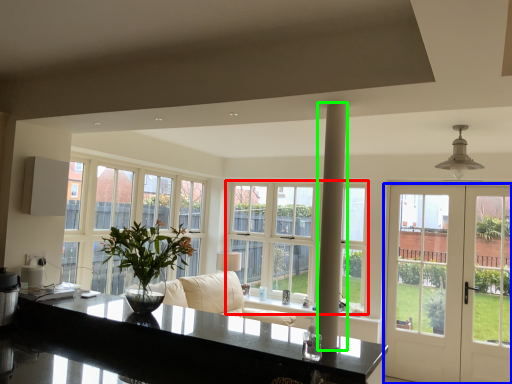
Question: Which is nearer to the window (highlighted by a red box)? door (highlighted by a blue box) or pillar (highlighted by a green box).

Choices:
 (A) door
 (B) pillar

Answer: (A)